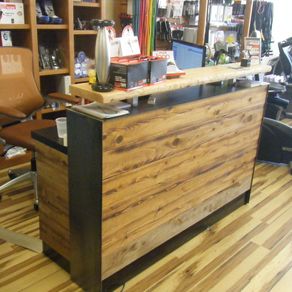
At what (x,y) coordinates should I click in order to perform the action: click on rainbow colored item - possibly curtains. Please return your answer as a coordinate pair (x, y). This screenshot has width=292, height=292. Looking at the image, I should click on (147, 22).